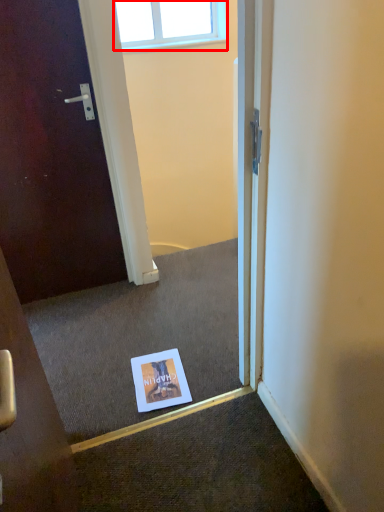
Question: From the image's perspective, considering the relative positions of window (annotated by the red box) and flyer in the image provided, where is window (annotated by the red box) located with respect to the staircase?

Choices:
 (A) above
 (B) below

Answer: (A)